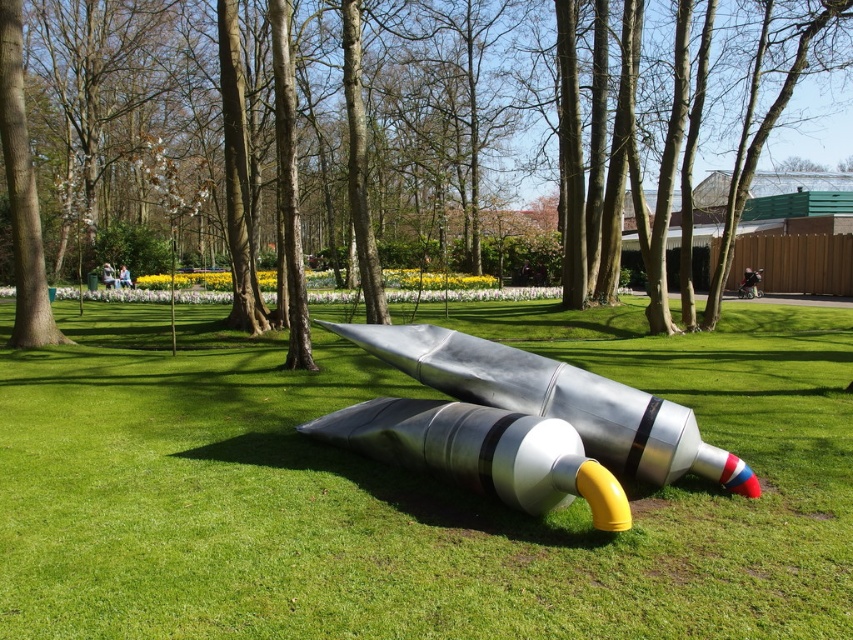
You are planning to place a new bench in the park. The bench is 1.5 meters wide. You want to place it near the brushed metal tree at center and the polished metallic rocket at center. Based on their sizes, which object should the bench be placed closer to so it doesn

The brushed metal tree at center is larger than the polished metallic rocket at center. Therefore, the bench should be placed closer to the polished metallic rocket at center to avoid blocking the view of the larger tree sculpture.

You are a maintenance worker in the park. You need to move both the metallic grass at center and the polished metallic rocket at center to a storage shed 10 feet away. Can you move them one at a time without needing to move the other while working?

The metallic grass at center and polished metallic rocket at center are 8.86 feet apart from each other. Since the storage shed is 10 feet away, you can move them one at a time without needing to move the other while working as the distance between them allows for individual access.

You are standing in the park and want to take a photo of the metallic grass at center and the brushed metal tree at center. Which object should you focus on first if you want both to be in sharp focus?

You should focus on the brushed metal tree at center first because it is farther away from the camera than the metallic grass at center, ensuring both are in focus when using depth of field techniques.